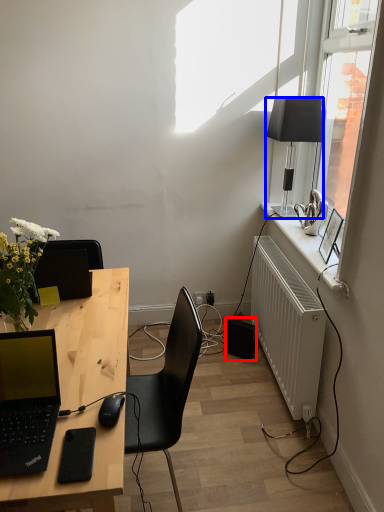
Question: Which object is closer to the camera taking this photo, speaker (highlighted by a red box) or lamp (highlighted by a blue box)?

Choices:
 (A) speaker
 (B) lamp

Answer: (B)